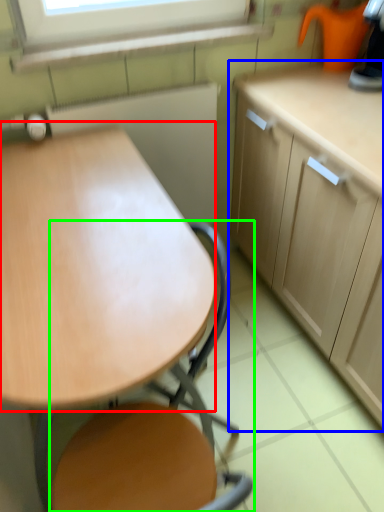
Question: Considering the real-world distances, which object is closest to round table (highlighted by a red box)? cabinetry (highlighted by a blue box) or chair (highlighted by a green box).

Choices:
 (A) cabinetry
 (B) chair

Answer: (B)